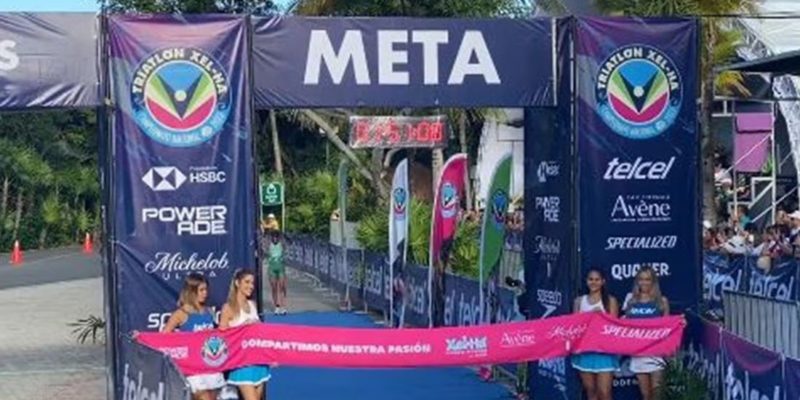
I want to click on blue carpet, so 349,380.